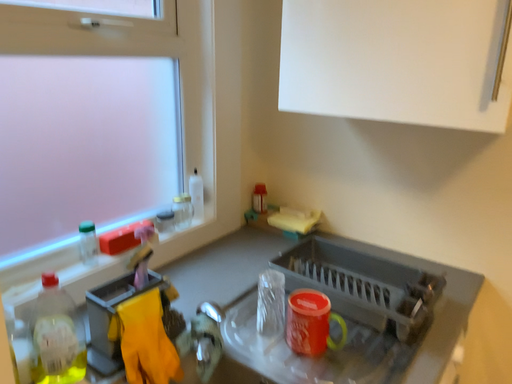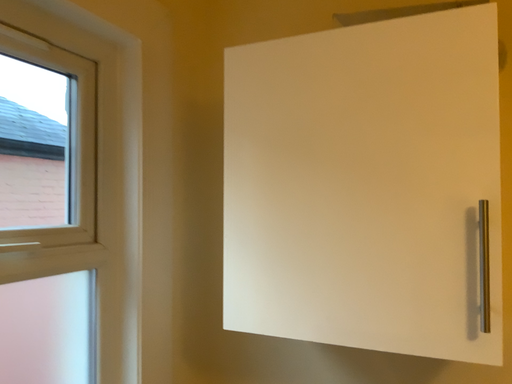
Question: Which way did the camera rotate in the video?

Choices:
 (A) rotated upward
 (B) rotated downward

Answer: (A)